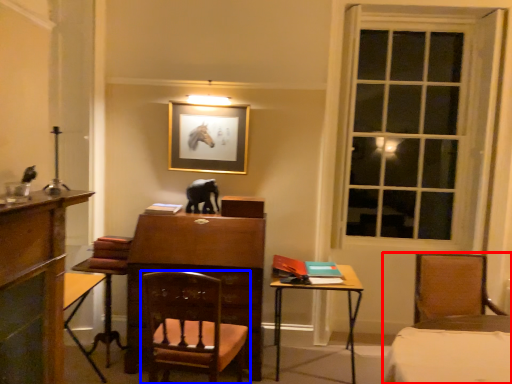
Question: Which object appears closest to the camera in this image, chair (highlighted by a red box) or chair (highlighted by a blue box)?

Choices:
 (A) chair
 (B) chair

Answer: (B)